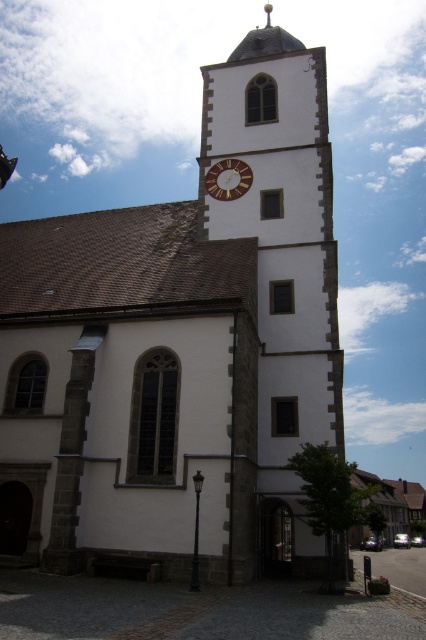
Question: Which object is farther from the camera taking this photo?

Choices:
 (A) white stone clock tower at center
 (B) gold metallic clock at center

Answer: (B)

Question: Which object appears farthest from the camera in this image?

Choices:
 (A) white stone clock tower at center
 (B) gold metallic clock at center

Answer: (B)

Question: Where is white stone clock tower at center located in relation to gold metallic clock at center in the image?

Choices:
 (A) above
 (B) below

Answer: (B)

Question: From the image, what is the correct spatial relationship of white stone clock tower at center in relation to gold metallic clock at center?

Choices:
 (A) below
 (B) above

Answer: (A)

Question: Which point appears closest to the camera in this image?

Choices:
 (A) (287, 310)
 (B) (250, 170)

Answer: (A)

Question: Is white stone clock tower at center wider than gold metallic clock at center?

Choices:
 (A) yes
 (B) no

Answer: (A)